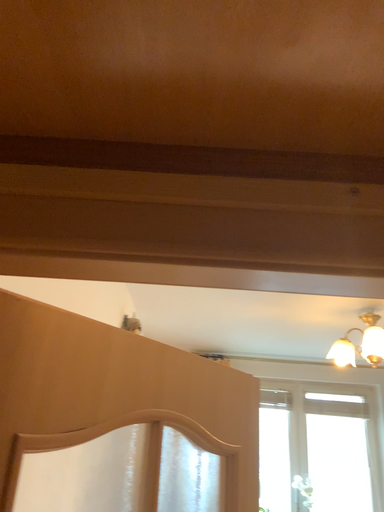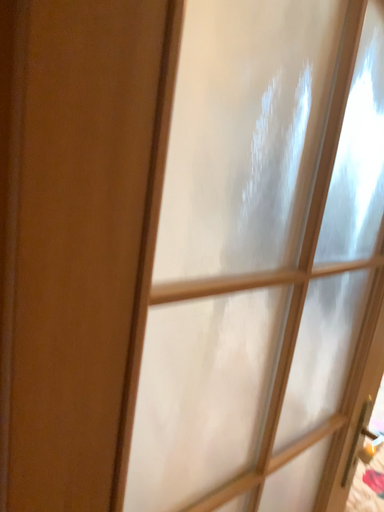
Question: Which way did the camera rotate in the video?

Choices:
 (A) rotated right
 (B) rotated left

Answer: (B)